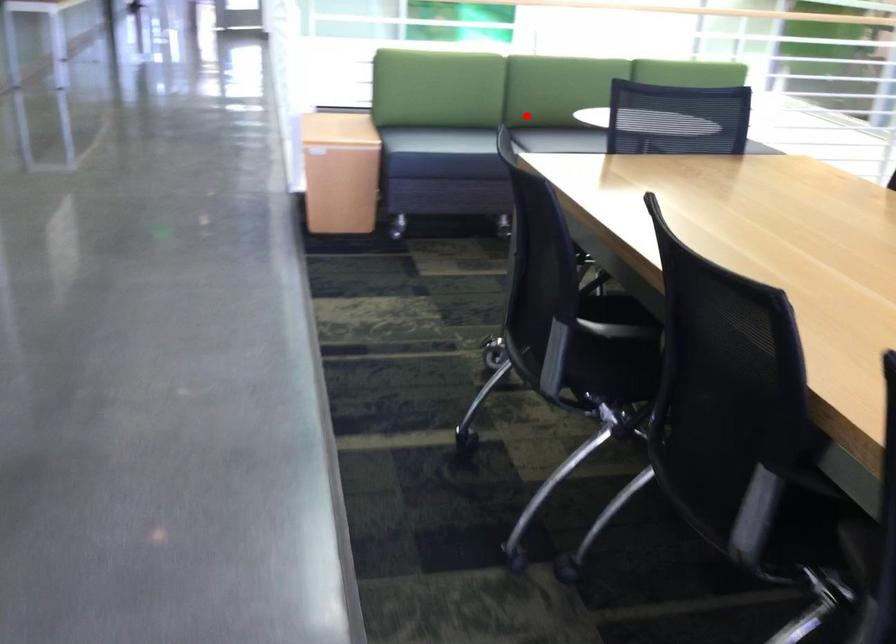
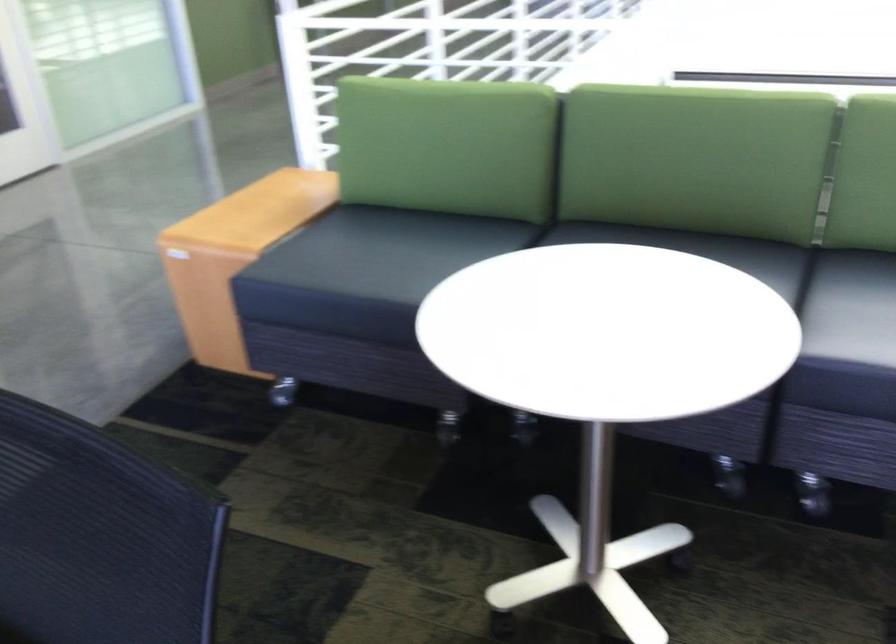
Question: A red point is marked in image1. In image2, is the corresponding 3D point closer to the camera or farther? Reply with the corresponding letter.

Choices:
 (A) The corresponding 3D point is closer.
 (B) The corresponding 3D point is farther.

Answer: (A)